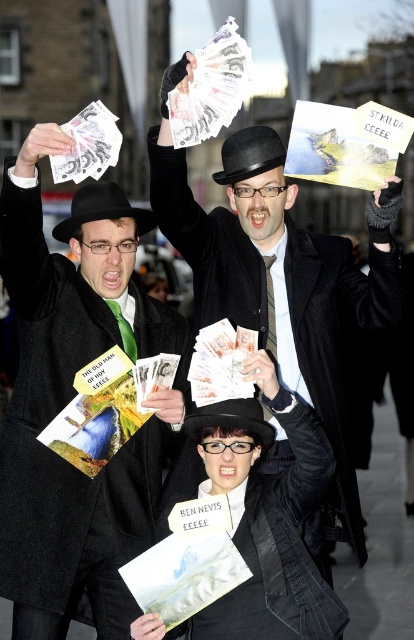
You are standing in the city street scene described. You need to locate the matte black coat at center. Where would you look relative to the buildings in the background?

The matte black coat at center is located at the coordinates point (284, 294) in the image, which is approximately in the lower middle area of the scene relative to the buildings in the background.

You are a photographer who needs to capture a clear shot of the matte black coat at center and the black felt hat at center. Based on their positions, which object should you focus on first to ensure both are in frame?

Since the matte black coat at center is to the right of the black felt hat at center, you should focus on the black felt hat at center first to ensure both are in frame.

You are a photographer trying to capture a clear shot of the white paper money at center and the matte black coat at upper left. Since you want to focus on both, which object should you adjust your camera focus on first?

The matte black coat at upper left is much taller than the white paper money at center, so you should focus on the matte black coat at upper left first to ensure it is in clear view before adjusting for the smaller white paper money at center.